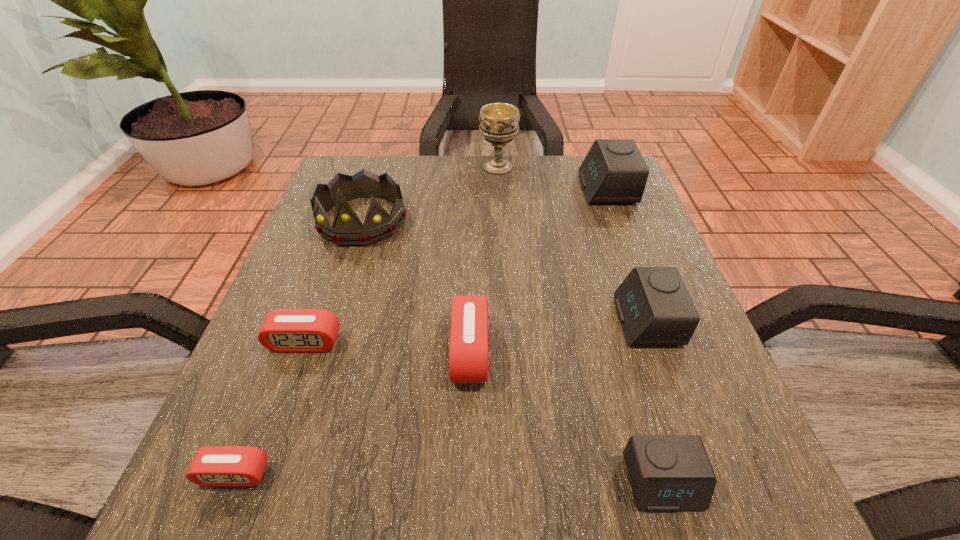
Find the location of a particular element. The image size is (960, 540). white chalice is located at coordinates (498, 122).

Identify the location of red tiara. The width and height of the screenshot is (960, 540). (347, 230).

Identify the location of the tallest alarm clock. (614, 171).

What are the coordinates of `the sixth shortest object` in the screenshot? It's located at (614, 171).

Where is `the second farthest black alarm clock`? This screenshot has width=960, height=540. the second farthest black alarm clock is located at coordinates (654, 306).

Identify the location of the rightmost pink alarm clock. This screenshot has height=540, width=960. pyautogui.click(x=468, y=354).

Locate an element on the screen. The width and height of the screenshot is (960, 540). the biggest pink alarm clock is located at coordinates (468, 354).

Locate an element on the screen. This screenshot has width=960, height=540. the second smallest pink alarm clock is located at coordinates pyautogui.click(x=283, y=330).

The width and height of the screenshot is (960, 540). I want to click on the nearest black alarm clock, so click(x=668, y=473).

You are a GUI agent. You are given a task and a screenshot of the screen. Output one action in this format:
    pyautogui.click(x=<x>, y=<y>)
    Task: Click on the smallest pink alarm clock
    The width and height of the screenshot is (960, 540).
    Given the screenshot: What is the action you would take?
    pyautogui.click(x=211, y=466)